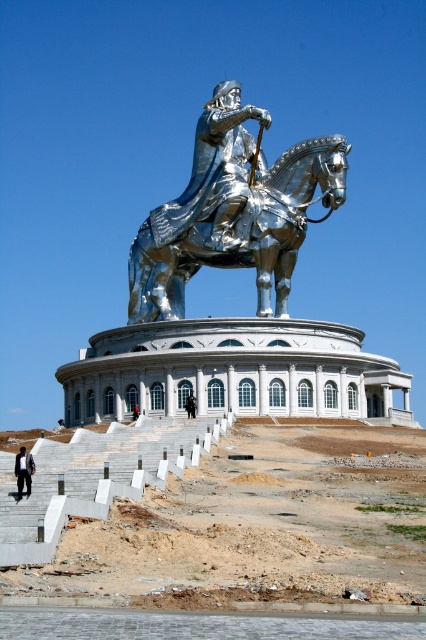
You are a tour guide explaining the statue to visitors. You want to mention the relative positions of the shiny chrome horse at center and the brushed metal helmet at upper center. How would you describe their arrangement?

The shiny chrome horse at center is positioned above the brushed metal helmet at upper center, meaning the horse is higher up in the statue structure compared to the helmet.

From the picture: You are standing in front of the statue and want to touch both the shiny chrome horse at center and the dark brown leather coat at center. Which object should you reach for first if you want to touch the one closer to your left side?

You should reach for the dark brown leather coat at center first because it is to the left of the shiny chrome horse at center, making it closer to your left side.

You are standing at the entrance of the building and want to take a photo of the shiny chrome horse at center. Based on its position, where should you aim your camera to capture it in the frame?

You should aim your camera at the point 0.366 on the horizontal axis and 0.563 on the vertical axis to capture the shiny chrome horse at center in the frame.